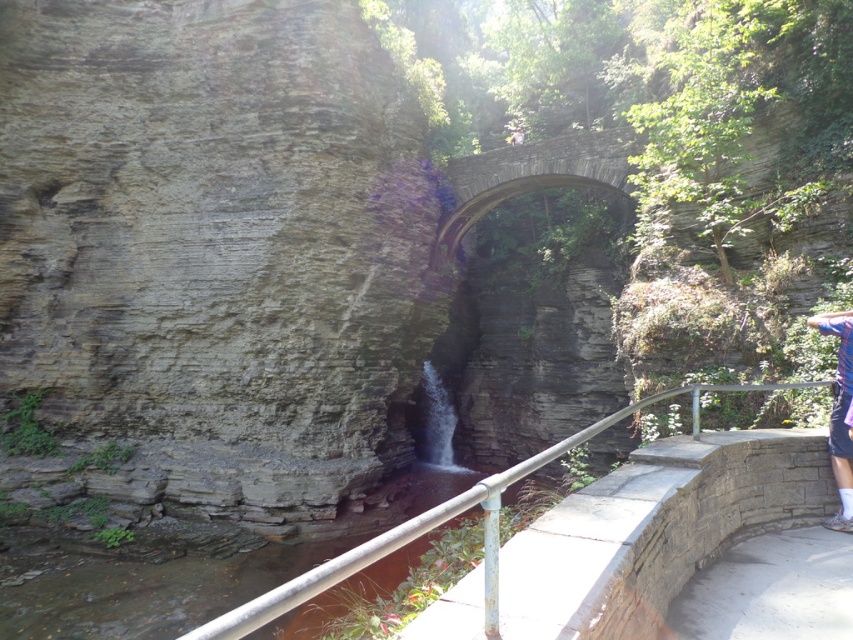
You are a hiker who has just reached the stone arch bridge at center. You want to take a photo of the bridge with your smartphone camera, which has a maximum focus range of 10 meters. Will the bridge be in focus?

The stone arch bridge at center is 13.53 meters away from the camera. Since the maximum focus range is 10 meters, the bridge will not be in focus.

Looking at this image, you are standing on the metallic gray rail at lower center and want to cross to the stone arch bridge at center. Which direction should you move to reach it?

The stone arch bridge at center is to the right of the metallic gray rail at lower center, so you should move to your right to reach it.

You are a hiker who wants to cross the stone arch bridge at center. There is a deep canyon below. If you drop a rock from the bridge, how far will it fall before hitting the canyon floor?

The stone arch bridge at center is 44.40 feet above the canyon floor. The rock will fall 44.40 feet before hitting the canyon floor.